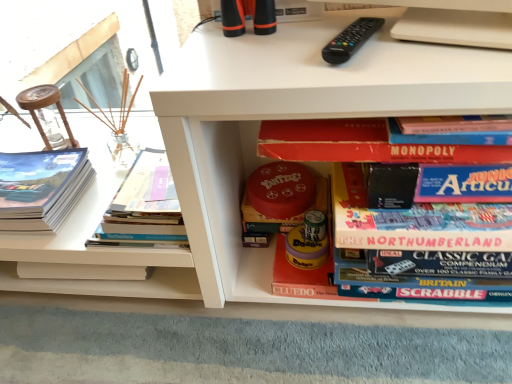
Question: Considering the positions of black plastic remote at upper center and hardcover book at left, which appears as the second book when viewed from the left, in the image, is black plastic remote at upper center taller or shorter than hardcover book at left, which appears as the second book when viewed from the left,?

Choices:
 (A) short
 (B) tall

Answer: (A)

Question: From the image's perspective, relative to hardcover book at left, which appears as the second book when viewed from the left, is black plastic remote at upper center above or below?

Choices:
 (A) below
 (B) above

Answer: (B)

Question: Based on their relative distances, which object is nearer to the matte paper book at left, which ranks as the fourth book in right-to-left order?

Choices:
 (A) red matte yahtzee board game at center, the third book from the left
 (B) hardcover book at left, the 3th book in the right-to-left sequence
 (C) black plastic remote at upper center
 (D) red matte board game at center, which is counted as the first book, starting from the right

Answer: (B)

Question: Estimate the real-world distances between objects in this image. Which object is farther from the red matte board game at center, which is counted as the first book, starting from the right?

Choices:
 (A) matte paper book at left, which ranks as the fourth book in right-to-left order
 (B) hardcover book at left, which appears as the second book when viewed from the left
 (C) black plastic remote at upper center
 (D) red matte yahtzee board game at center, the third book from the left

Answer: (A)